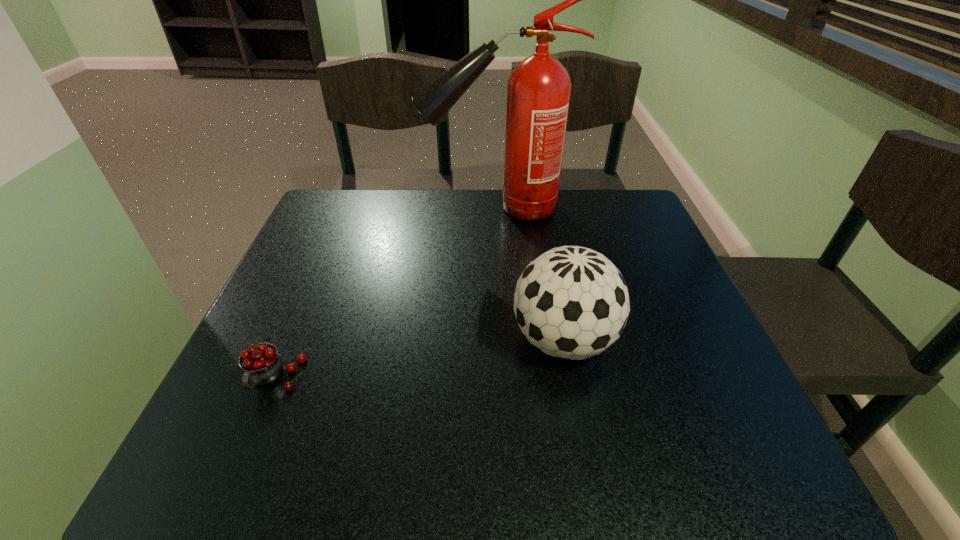
The image size is (960, 540). Identify the location of the tallest object. (538, 90).

Identify the location of fire extinguisher. The height and width of the screenshot is (540, 960). (538, 90).

At what (x,y) coordinates should I click in order to perform the action: click on the second shortest object. Please return your answer as a coordinate pair (x, y). Looking at the image, I should click on (571, 302).

Identify the location of cherry. The height and width of the screenshot is (540, 960). (262, 364).

In order to click on the leftmost object in this screenshot , I will do `click(262, 364)`.

This screenshot has height=540, width=960. Find the location of `free space located at the nozzle end of the fire extinguisher`. free space located at the nozzle end of the fire extinguisher is located at coordinates (359, 208).

Locate an element on the screen. free space located at the nozzle end of the fire extinguisher is located at coordinates (315, 208).

Identify the location of free point located at the nozzle end of the fire extinguisher. Image resolution: width=960 pixels, height=540 pixels. (371, 208).

Image resolution: width=960 pixels, height=540 pixels. Identify the location of free space located 0.140m on the right of the second shortest object. (688, 341).

Image resolution: width=960 pixels, height=540 pixels. What are the coordinates of `vacant space positioned on the handle side of the cherry` in the screenshot? It's located at (231, 479).